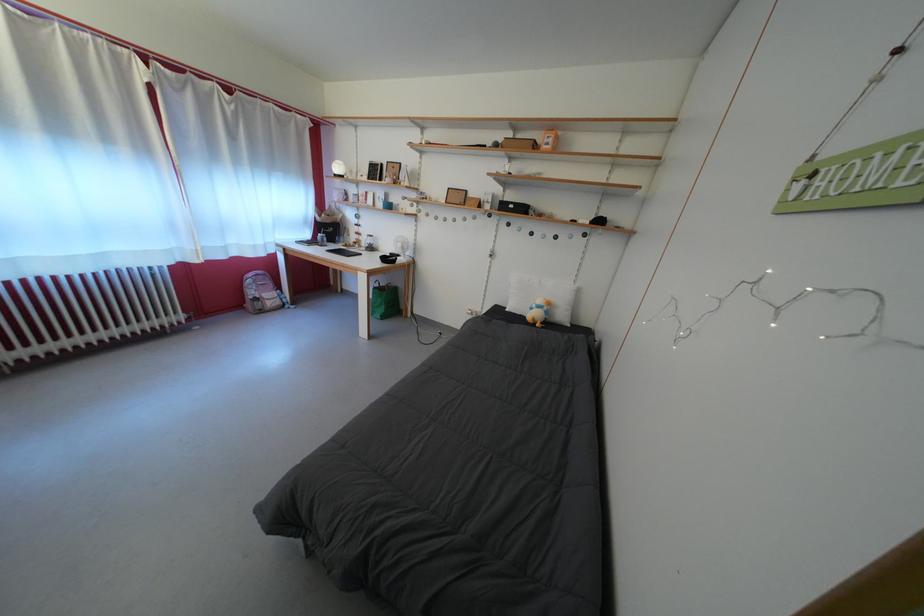
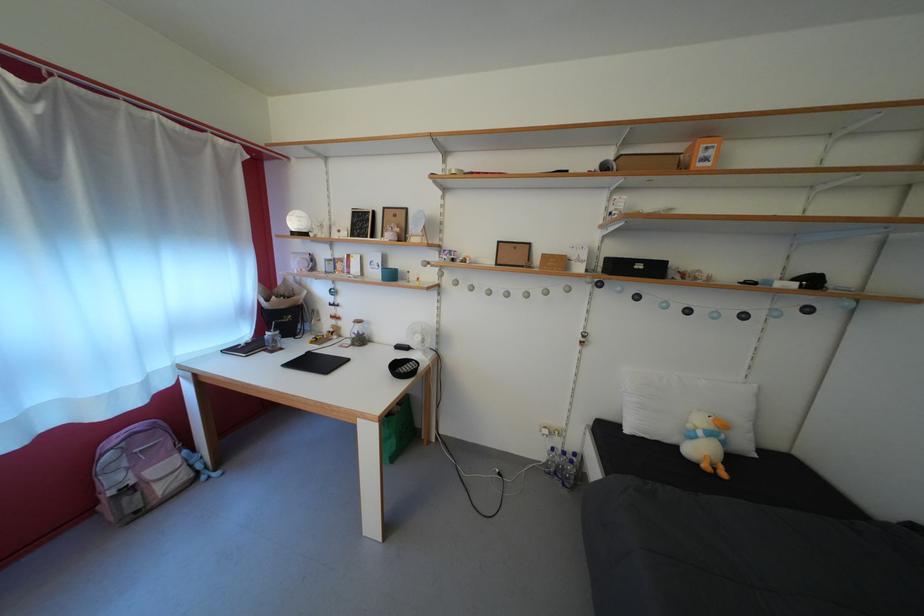
Question: I am providing you with two images of the same scene from different viewpoints. Which of the following objects are not visible in image2?

Choices:
 (A) stuffed duck toy
 (B) small white fan
 (C) white pillow
 (D) none of these

Answer: (D)